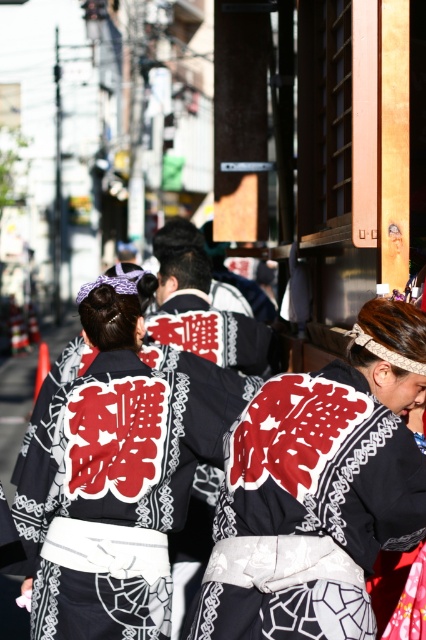
Question: Can you confirm if black fabric kimono at center is smaller than black silk kimono at center?

Choices:
 (A) no
 (B) yes

Answer: (B)

Question: Does black fabric kimono at center have a smaller size compared to black silk kimono at center?

Choices:
 (A) no
 (B) yes

Answer: (B)

Question: Which point is farther to the camera?

Choices:
 (A) (236, 522)
 (B) (75, 580)

Answer: (B)

Question: Is black fabric kimono at center to the left of black silk kimono at center from the viewer's perspective?

Choices:
 (A) no
 (B) yes

Answer: (A)